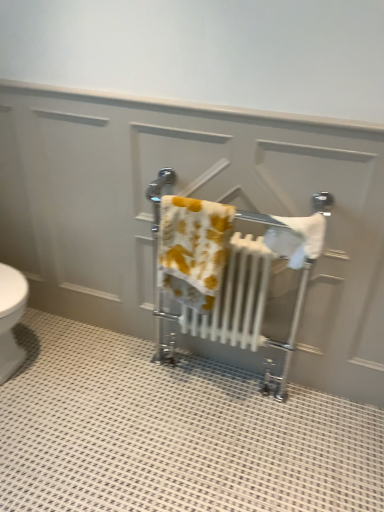
Question: Does white cotton towel at center, which is counted as the 1th bath towel, starting from the right, have a lesser width compared to yellow printed towel at center, the 1th bath towel positioned from the left?

Choices:
 (A) yes
 (B) no

Answer: (B)

Question: Is white cotton towel at center, which is counted as the 1th bath towel, starting from the right, placed right next to yellow printed towel at center, the 1th bath towel positioned from the left?

Choices:
 (A) yes
 (B) no

Answer: (B)

Question: From a real-world perspective, is white cotton towel at center, the second bath towel viewed from the left, located beneath yellow printed towel at center, marked as the 2th bath towel in a right-to-left arrangement?

Choices:
 (A) no
 (B) yes

Answer: (A)

Question: Does white cotton towel at center, which is counted as the 1th bath towel, starting from the right, have a greater width compared to yellow printed towel at center, the 1th bath towel positioned from the left?

Choices:
 (A) no
 (B) yes

Answer: (B)

Question: From the image's perspective, is white cotton towel at center, the second bath towel viewed from the left, over yellow printed towel at center, marked as the 2th bath towel in a right-to-left arrangement?

Choices:
 (A) yes
 (B) no

Answer: (A)

Question: From the image's perspective, is white cotton towel at center, which is counted as the 1th bath towel, starting from the right, positioned above or below yellow printed towel at center, marked as the 2th bath towel in a right-to-left arrangement?

Choices:
 (A) below
 (B) above

Answer: (B)

Question: In terms of height, does white cotton towel at center, which is counted as the 1th bath towel, starting from the right, look taller or shorter compared to yellow printed towel at center, the 1th bath towel positioned from the left?

Choices:
 (A) short
 (B) tall

Answer: (A)

Question: Is white cotton towel at center, the second bath towel viewed from the left, spatially inside yellow printed towel at center, the 1th bath towel positioned from the left, or outside of it?

Choices:
 (A) inside
 (B) outside

Answer: (B)

Question: Is point (288, 227) closer or farther from the camera than point (180, 207)?

Choices:
 (A) closer
 (B) farther

Answer: (A)

Question: Relative to white cotton towel at center, which is counted as the 1th bath towel, starting from the right, is white metallic towel rack at center in front or behind?

Choices:
 (A) behind
 (B) front

Answer: (A)

Question: Is white metallic towel rack at center taller or shorter than white cotton towel at center, which is counted as the 1th bath towel, starting from the right?

Choices:
 (A) short
 (B) tall

Answer: (B)

Question: Considering the positions of white metallic towel rack at center and white cotton towel at center, which is counted as the 1th bath towel, starting from the right, in the image, is white metallic towel rack at center wider or thinner than white cotton towel at center, which is counted as the 1th bath towel, starting from the right,?

Choices:
 (A) thin
 (B) wide

Answer: (B)

Question: From a real-world perspective, relative to white cotton towel at center, which is counted as the 1th bath towel, starting from the right, is white metallic towel rack at center vertically above or below?

Choices:
 (A) below
 (B) above

Answer: (A)

Question: From their relative heights in the image, would you say yellow printed towel at center, the 1th bath towel positioned from the left, is taller or shorter than white cotton towel at center, which is counted as the 1th bath towel, starting from the right?

Choices:
 (A) tall
 (B) short

Answer: (A)

Question: From the image's perspective, is yellow printed towel at center, the 1th bath towel positioned from the left, positioned above or below white cotton towel at center, the second bath towel viewed from the left?

Choices:
 (A) above
 (B) below

Answer: (B)